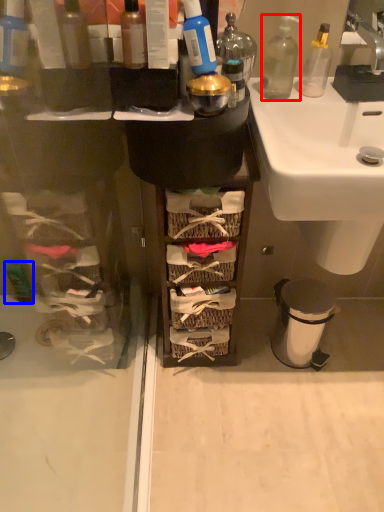
Question: Among these objects, which one is nearest to the camera, bottle (highlighted by a red box) or toiletry (highlighted by a blue box)?

Choices:
 (A) bottle
 (B) toiletry

Answer: (A)